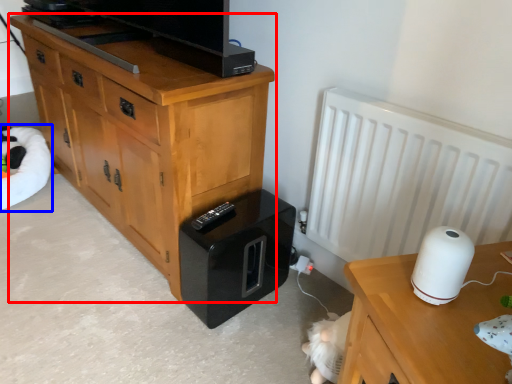
Question: Which object appears closest to the camera in this image, chest of drawers (highlighted by a red box) or bean bag chair (highlighted by a blue box)?

Choices:
 (A) chest of drawers
 (B) bean bag chair

Answer: (A)